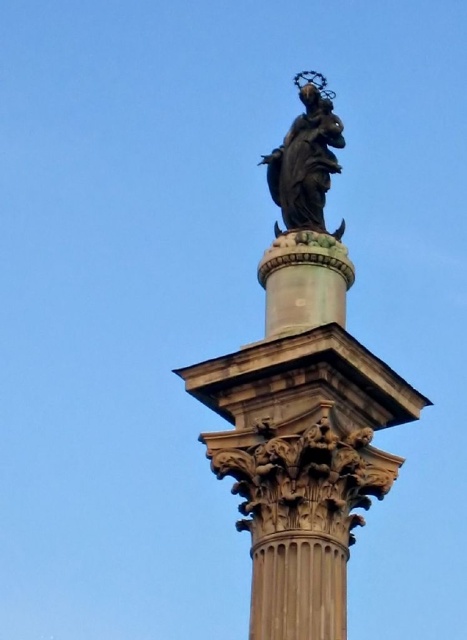
Is point (290, 140) positioned after point (305, 113)?

No, (290, 140) is in front of (305, 113).

This screenshot has width=467, height=640. I want to click on bronze statue at upper center, so click(303, 400).

You are a GUI agent. You are given a task and a screenshot of the screen. Output one action in this format:
    pyautogui.click(x=<x>, y=<y>)
    Task: Click on the bronze statue at upper center
    The image size is (467, 640).
    Given the screenshot: What is the action you would take?
    pyautogui.click(x=303, y=400)